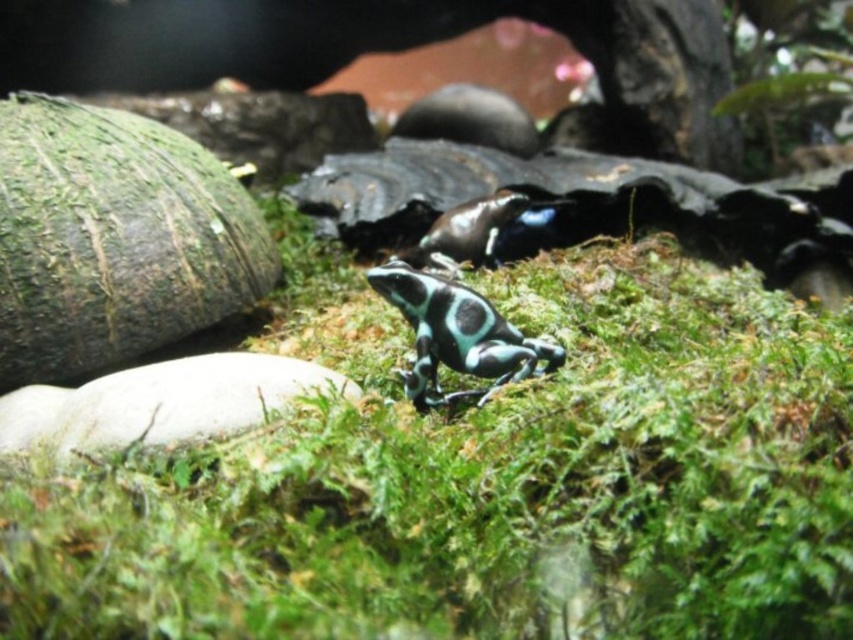
You are a small insect trying to climb over the green mossy grass at center and the smooth green tortoise at center. Which one do you think will be taller for you to climb?

The green mossy grass at center is taller than the smooth green tortoise at center, so the insect will find the green mossy grass at center to be the taller one to climb.

You are a researcher studying the habitat of the smooth green tortoise at center. Based on the coordinates provided, can you determine if the tortoise is positioned closer to the top or bottom of the image?

The smooth green tortoise at center is located at point (456, 333), which places it near the center of the image. Since both coordinates are approximately 0.5, it is equidistant from the top and bottom edges.

You are a photographer trying to capture both the smooth green tortoise at center and the shiny black tortoise at center in a single frame. Based on their positions, which tortoise should you adjust your camera focus to first to ensure both are in the frame?

The smooth green tortoise at center is to the left of shiny black tortoise at center, so you should focus on the shiny black tortoise at center first as it is further to the right and closer to the center, ensuring both are within the frame.